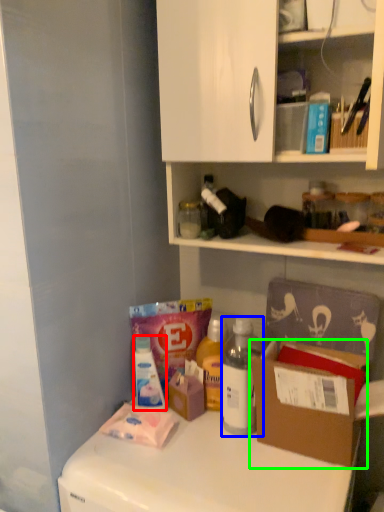
Question: Considering the real-world distances, which object is closest to bottle (highlighted by a red box)? bottle (highlighted by a blue box) or cardboard box (highlighted by a green box).

Choices:
 (A) bottle
 (B) cardboard box

Answer: (A)